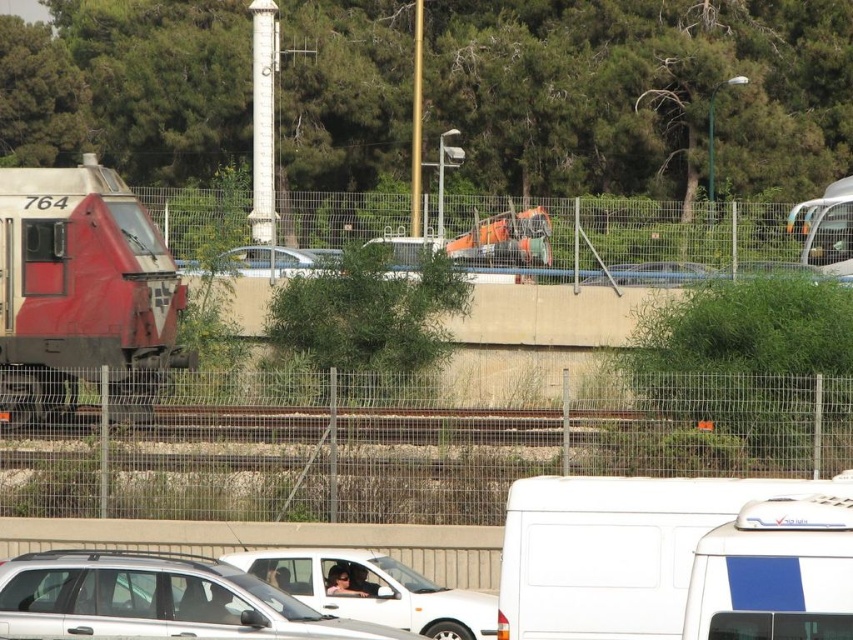
Question: Which of the following is the farthest from the observer?

Choices:
 (A) silver metallic sedan at center
 (B) white matte van at lower right
 (C) white matte van at upper right
 (D) white matte car at center

Answer: (C)

Question: Can you confirm if silver metallic suv at center is wider than white matte car at center?

Choices:
 (A) no
 (B) yes

Answer: (B)

Question: Which object is the closest to the matte red train at left?

Choices:
 (A) white matte car at center
 (B) white matte van at upper right

Answer: (A)

Question: Can you confirm if silver metallic suv at center is smaller than white matte van at upper right?

Choices:
 (A) yes
 (B) no

Answer: (A)

Question: Which point is farther to the camera?

Choices:
 (A) white matte van at lower right
 (B) white matte car at center
 (C) white matte van at upper right
 (D) silver metallic suv at center

Answer: (C)

Question: Is white matte van at lower right to the left of white matte van at upper right from the viewer's perspective?

Choices:
 (A) yes
 (B) no

Answer: (A)